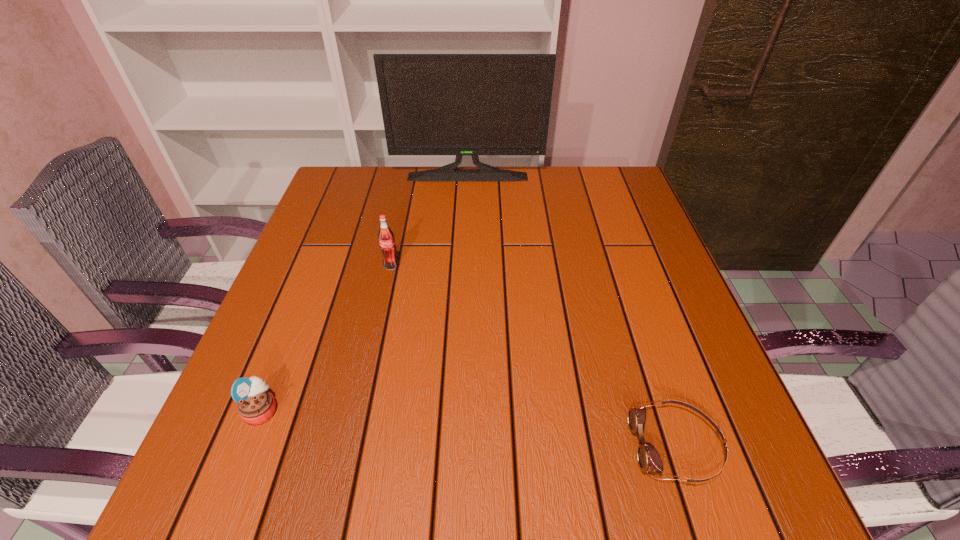
At what (x,y) coordinates should I click in order to perform the action: click on vacant space that satisfies the following two spatial constraints: 1. on the label of the second tallest object; 2. on the front-facing side of the muffin. Please return your answer as a coordinate pair (x, y). The image size is (960, 540). Looking at the image, I should click on (361, 410).

Locate an element on the screen. This screenshot has height=540, width=960. blank space that satisfies the following two spatial constraints: 1. on the label of the second tallest object; 2. on the front-facing side of the third tallest object is located at coordinates (361, 410).

Locate an element on the screen. This screenshot has height=540, width=960. vacant space that satisfies the following two spatial constraints: 1. on the front-facing side of the tallest object; 2. on the front-facing side of the leftmost object is located at coordinates (459, 410).